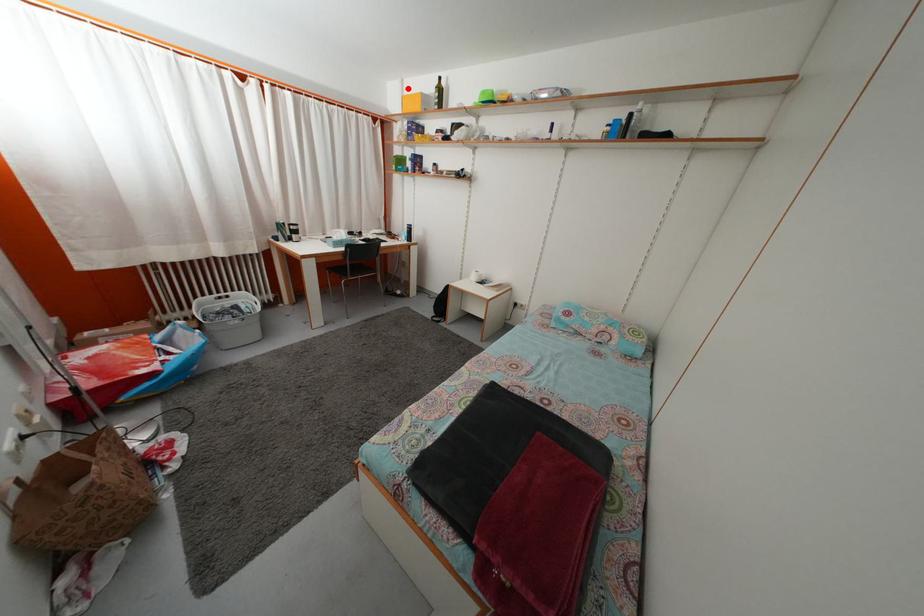
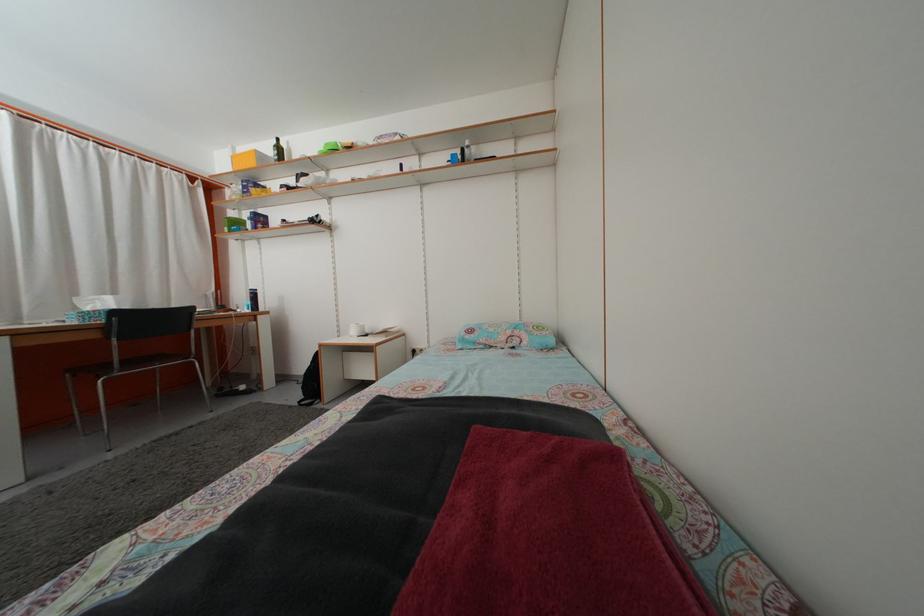
Question: I am providing you with two images of the same scene from different viewpoints. A red point is marked on the first image. At the location where the point appears in image 1, is it still visible in image 2?

Choices:
 (A) Yes
 (B) No

Answer: (A)